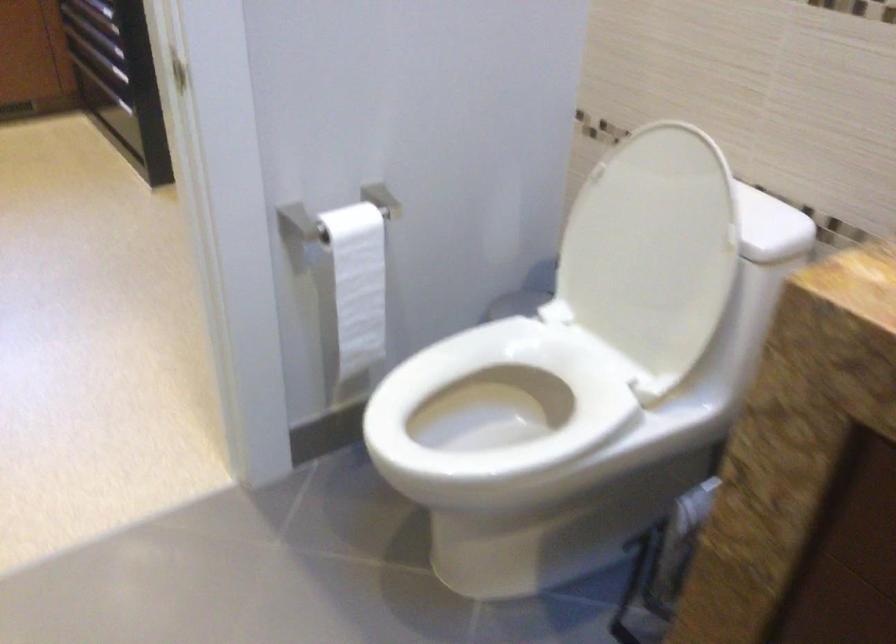
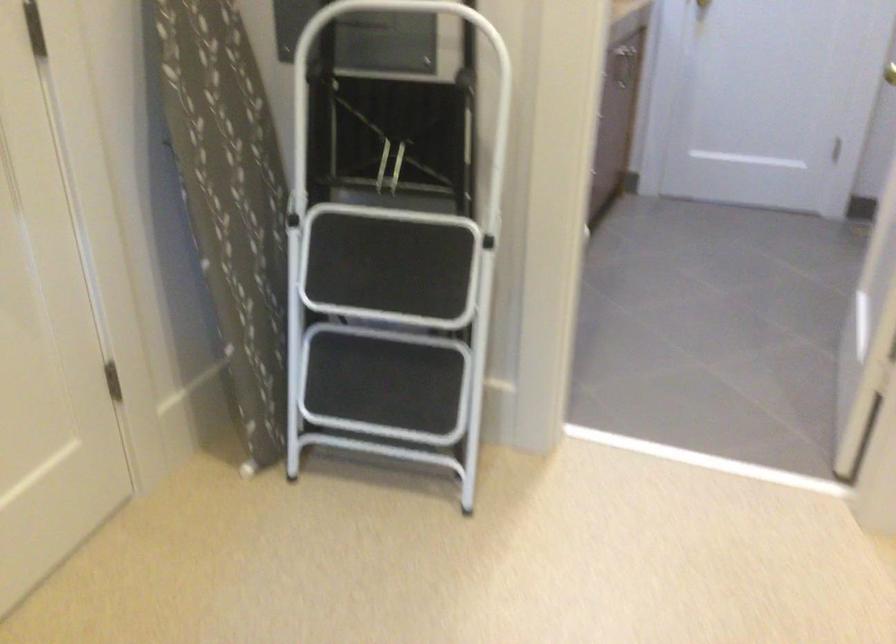
Where in the second image is the point corresponding to (x=455, y=289) from the first image?

(371, 324)